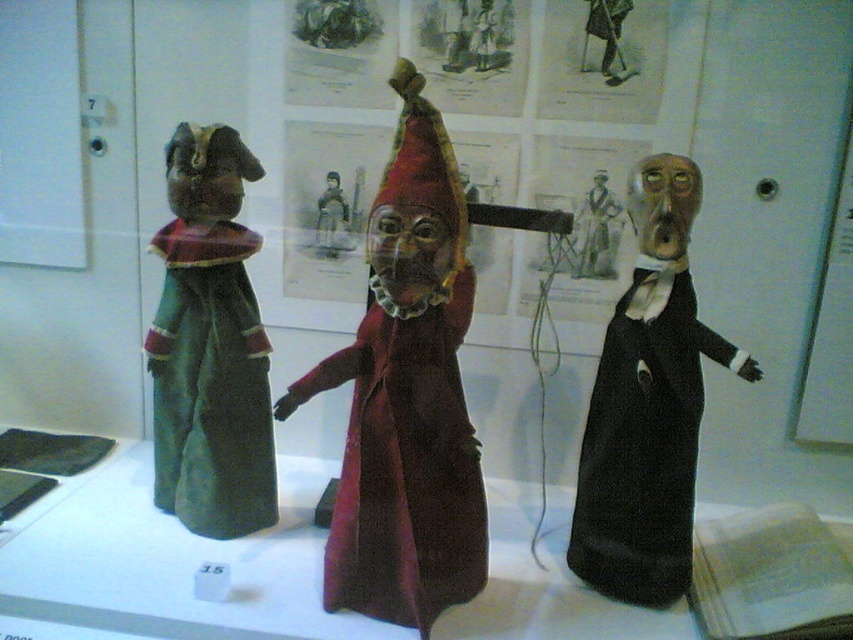
Question: From the image, what is the correct spatial relationship of velvet maroon coat at center in relation to green felt doll at left?

Choices:
 (A) left
 (B) right

Answer: (B)

Question: Is velvet maroon coat at center above black velvet dress at right?

Choices:
 (A) no
 (B) yes

Answer: (B)

Question: Considering the real-world distances, which object is farthest from the green felt doll at left?

Choices:
 (A) black velvet dress at right
 (B) velvet maroon coat at center

Answer: (A)

Question: Which object appears farthest from the camera in this image?

Choices:
 (A) green felt doll at left
 (B) velvet maroon coat at center

Answer: (A)

Question: Does green felt doll at left have a smaller size compared to black velvet dress at right?

Choices:
 (A) yes
 (B) no

Answer: (B)

Question: Which point is farther to the camera?

Choices:
 (A) velvet maroon coat at center
 (B) green felt doll at left
 (C) black velvet dress at right

Answer: (B)